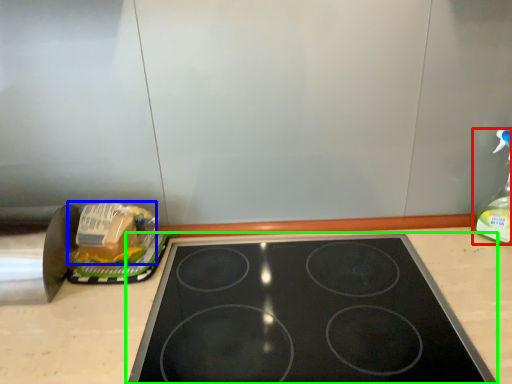
Question: Estimate the real-world distances between objects in this image. Which object is farther from bottle (highlighted by a red box), food (highlighted by a blue box) or gas stove (highlighted by a green box)?

Choices:
 (A) food
 (B) gas stove

Answer: (A)